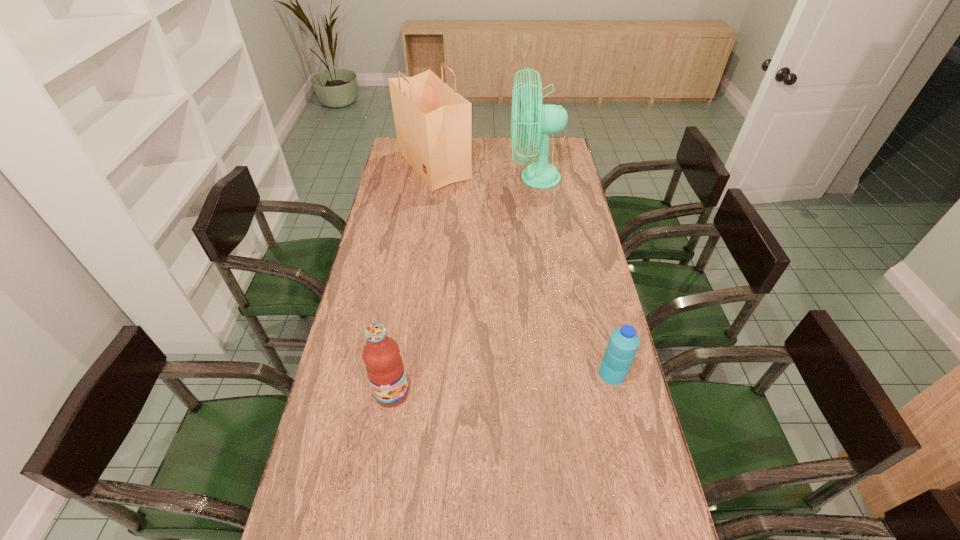
At what (x,y) coordinates should I click in order to perform the action: click on free space that satisfies the following two spatial constraints: 1. on the side of the grocery bag with the superhero design; 2. on the front label of the third tallest object. Please return your answer as a coordinate pair (x, y). Looking at the image, I should click on (403, 393).

Identify the location of free point that satisfies the following two spatial constraints: 1. on the side of the grocery bag with the superhero design; 2. on the right side of the shortest object. (406, 374).

Locate an element on the screen. This screenshot has width=960, height=540. vacant space that satisfies the following two spatial constraints: 1. on the side of the grocery bag with the superhero design; 2. on the front label of the fruit juice is located at coordinates (403, 393).